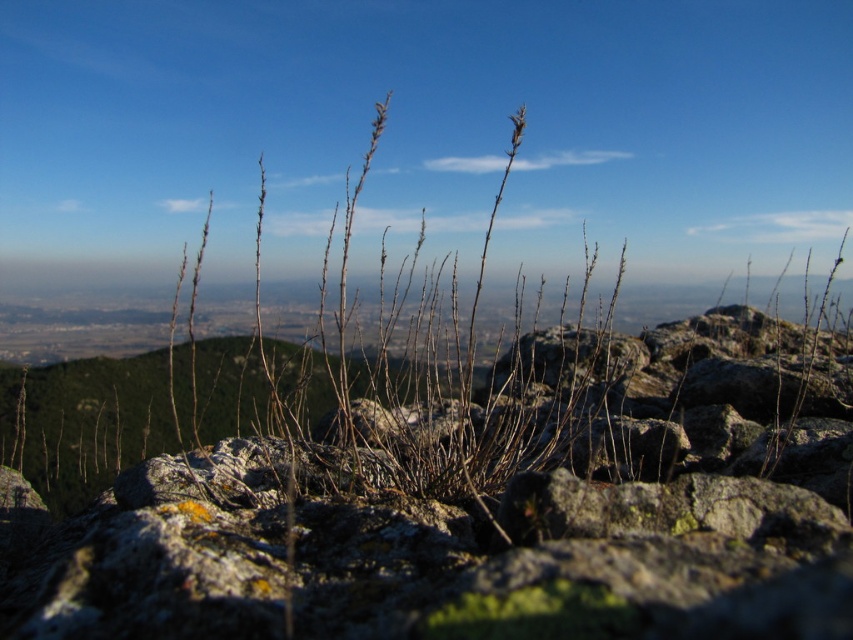
Question: Among these points, which one is nearest to the camera?

Choices:
 (A) (343, 557)
 (B) (529, 371)

Answer: (A)

Question: Does gray rough rock at center appear under brown dry grass at center?

Choices:
 (A) yes
 (B) no

Answer: (A)

Question: From the image, what is the correct spatial relationship of gray rough rock at center in relation to brown dry grass at center?

Choices:
 (A) below
 (B) above

Answer: (A)

Question: Is gray rough rock at center closer to camera compared to brown dry grass at center?

Choices:
 (A) no
 (B) yes

Answer: (B)

Question: Which point appears farthest from the camera in this image?

Choices:
 (A) (380, 378)
 (B) (524, 499)

Answer: (A)